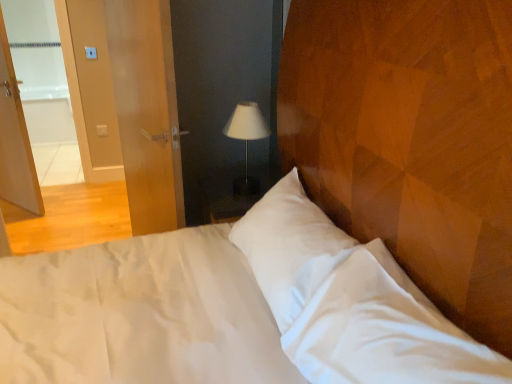
Question: Can you confirm if matte wood door at left is bigger than white fabric lampshade at center?

Choices:
 (A) no
 (B) yes

Answer: (B)

Question: Is the depth of matte wood door at left greater than that of white fabric lampshade at center?

Choices:
 (A) no
 (B) yes

Answer: (A)

Question: Can you confirm if matte wood door at left is taller than white fabric lampshade at center?

Choices:
 (A) yes
 (B) no

Answer: (A)

Question: Can you confirm if matte wood door at left is positioned to the right of white fabric lampshade at center?

Choices:
 (A) no
 (B) yes

Answer: (A)

Question: Is matte wood door at left oriented away from white fabric lampshade at center?

Choices:
 (A) no
 (B) yes

Answer: (B)

Question: Is matte wood door at left taller or shorter than white plastic light switch at upper left?

Choices:
 (A) short
 (B) tall

Answer: (B)

Question: From a real-world perspective, is matte wood door at left above or below white plastic light switch at upper left?

Choices:
 (A) above
 (B) below

Answer: (A)

Question: From the image's perspective, is matte wood door at left above or below white plastic light switch at upper left?

Choices:
 (A) below
 (B) above

Answer: (A)

Question: Based on their sizes in the image, would you say matte wood door at left is bigger or smaller than white plastic light switch at upper left?

Choices:
 (A) small
 (B) big

Answer: (B)

Question: Looking at the image, does white fabric lampshade at center seem bigger or smaller compared to matte wood door at left?

Choices:
 (A) small
 (B) big

Answer: (A)

Question: Does point (225, 122) appear closer or farther from the camera than point (145, 56)?

Choices:
 (A) farther
 (B) closer

Answer: (A)

Question: Is white fabric lampshade at center wider or thinner than matte wood door at left?

Choices:
 (A) wide
 (B) thin

Answer: (A)

Question: Is white fabric lampshade at center taller or shorter than matte wood door at left?

Choices:
 (A) tall
 (B) short

Answer: (B)

Question: Considering the positions of white plastic light switch at upper left and white fabric lampshade at center in the image, is white plastic light switch at upper left bigger or smaller than white fabric lampshade at center?

Choices:
 (A) small
 (B) big

Answer: (A)

Question: Is white plastic light switch at upper left inside the boundaries of white fabric lampshade at center, or outside?

Choices:
 (A) outside
 (B) inside

Answer: (A)